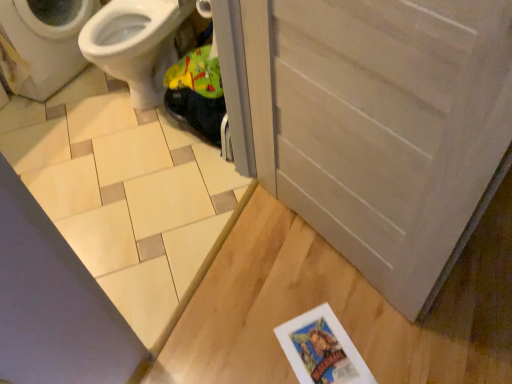
Question: Can you confirm if beige ceramic tile at lower left is positioned to the right of white glossy bidet at upper left?

Choices:
 (A) no
 (B) yes

Answer: (A)

Question: From the image's perspective, is beige ceramic tile at lower left located above white glossy bidet at upper left?

Choices:
 (A) no
 (B) yes

Answer: (A)

Question: From the image's perspective, is beige ceramic tile at lower left beneath white glossy bidet at upper left?

Choices:
 (A) no
 (B) yes

Answer: (B)

Question: Is white glossy bidet at upper left inside beige ceramic tile at lower left?

Choices:
 (A) yes
 (B) no

Answer: (B)

Question: Can you confirm if beige ceramic tile at lower left is smaller than white glossy bidet at upper left?

Choices:
 (A) no
 (B) yes

Answer: (B)

Question: From a real-world perspective, does beige ceramic tile at lower left stand above white glossy bidet at upper left?

Choices:
 (A) yes
 (B) no

Answer: (B)

Question: Can you confirm if white matte screen door at lower right is positioned to the left of white glossy bidet at upper left?

Choices:
 (A) yes
 (B) no

Answer: (B)

Question: Considering the relative sizes of white matte screen door at lower right and white glossy bidet at upper left in the image provided, is white matte screen door at lower right smaller than white glossy bidet at upper left?

Choices:
 (A) yes
 (B) no

Answer: (A)

Question: Does white matte screen door at lower right have a greater width compared to white glossy bidet at upper left?

Choices:
 (A) yes
 (B) no

Answer: (B)

Question: Does white matte screen door at lower right have a larger size compared to white glossy bidet at upper left?

Choices:
 (A) no
 (B) yes

Answer: (A)

Question: Is white matte screen door at lower right not within white glossy bidet at upper left?

Choices:
 (A) yes
 (B) no

Answer: (A)

Question: Is white matte screen door at lower right closer to camera compared to white glossy bidet at upper left?

Choices:
 (A) yes
 (B) no

Answer: (A)

Question: Can beige ceramic tile at lower left be found inside white glossy bidet at upper left?

Choices:
 (A) yes
 (B) no

Answer: (B)